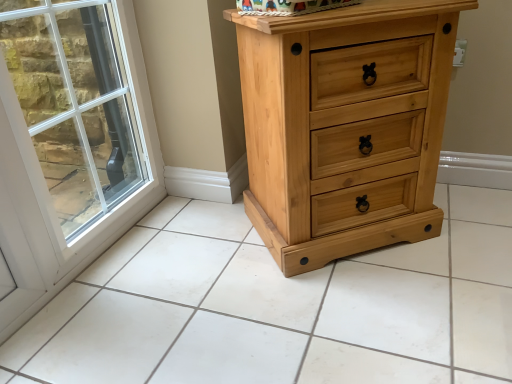
Question: Considering the positions of white glass window at left and natural wood chest of drawers at right in the image, is white glass window at left wider or thinner than natural wood chest of drawers at right?

Choices:
 (A) wide
 (B) thin

Answer: (B)

Question: Looking at the image, does white glass window at left seem bigger or smaller compared to natural wood chest of drawers at right?

Choices:
 (A) small
 (B) big

Answer: (A)

Question: Which is farther from the white glass window at left?

Choices:
 (A) natural wood chest of drawers at right
 (B) natural wood tile at center

Answer: (A)

Question: Which object is positioned farthest from the white glass window at left?

Choices:
 (A) natural wood chest of drawers at right
 (B) natural wood tile at center

Answer: (A)